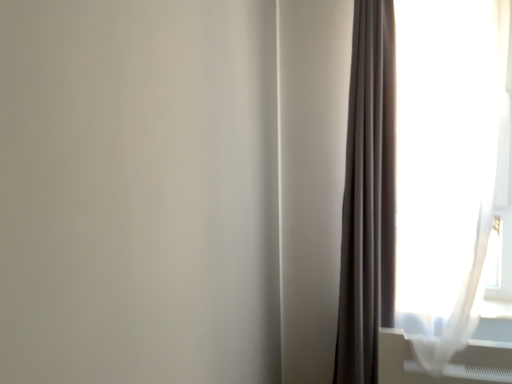
Question: Is the depth of matte gray curtain at right, the second curtain in the right-to-left sequence, greater than that of white sheer curtain at right, which is the second curtain from left to right?

Choices:
 (A) yes
 (B) no

Answer: (A)

Question: From a real-world perspective, does matte gray curtain at right, the second curtain in the right-to-left sequence, stand above white sheer curtain at right, which is the second curtain from left to right?

Choices:
 (A) yes
 (B) no

Answer: (B)

Question: Is matte gray curtain at right, the second curtain in the right-to-left sequence, with white sheer curtain at right, the first curtain in the right-to-left sequence?

Choices:
 (A) yes
 (B) no

Answer: (B)

Question: Is matte gray curtain at right, the second curtain in the right-to-left sequence, aimed at white sheer curtain at right, the first curtain in the right-to-left sequence?

Choices:
 (A) no
 (B) yes

Answer: (A)

Question: Is matte gray curtain at right, the second curtain in the right-to-left sequence, shorter than white sheer curtain at right, the first curtain in the right-to-left sequence?

Choices:
 (A) yes
 (B) no

Answer: (B)

Question: Could white sheer curtain at right, which is the second curtain from left to right, be considered to be inside matte gray curtain at right, the second curtain in the right-to-left sequence?

Choices:
 (A) no
 (B) yes

Answer: (A)

Question: Considering the relative positions of white sheer curtain at right, the first curtain in the right-to-left sequence, and matte gray curtain at right, arranged as the 1th curtain when viewed from the left, in the image provided, is white sheer curtain at right, the first curtain in the right-to-left sequence, to the left of matte gray curtain at right, arranged as the 1th curtain when viewed from the left, from the viewer's perspective?

Choices:
 (A) yes
 (B) no

Answer: (B)

Question: From a real-world perspective, is white sheer curtain at right, which is the second curtain from left to right, under matte gray curtain at right, arranged as the 1th curtain when viewed from the left?

Choices:
 (A) no
 (B) yes

Answer: (A)

Question: Does white sheer curtain at right, which is the second curtain from left to right, have a larger size compared to matte gray curtain at right, arranged as the 1th curtain when viewed from the left?

Choices:
 (A) yes
 (B) no

Answer: (A)

Question: Is white sheer curtain at right, which is the second curtain from left to right, in contact with matte gray curtain at right, arranged as the 1th curtain when viewed from the left?

Choices:
 (A) no
 (B) yes

Answer: (A)

Question: Is there a large distance between white sheer curtain at right, the first curtain in the right-to-left sequence, and matte gray curtain at right, arranged as the 1th curtain when viewed from the left?

Choices:
 (A) no
 (B) yes

Answer: (A)

Question: Considering the relative sizes of white sheer curtain at right, which is the second curtain from left to right, and matte gray curtain at right, arranged as the 1th curtain when viewed from the left, in the image provided, is white sheer curtain at right, which is the second curtain from left to right, taller than matte gray curtain at right, arranged as the 1th curtain when viewed from the left,?

Choices:
 (A) yes
 (B) no

Answer: (B)

Question: Is point (347, 256) positioned closer to the camera than point (387, 286)?

Choices:
 (A) farther
 (B) closer

Answer: (B)